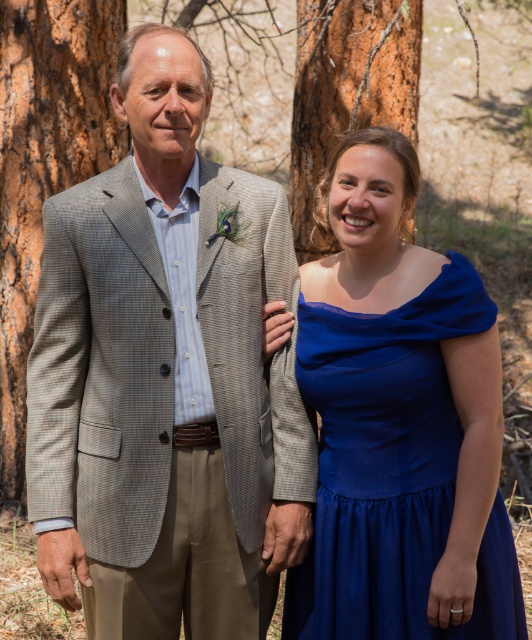
You are a photographer setting up a shot of the gray checkered suit at left and the brown textured bark at left. Which object should you focus on first if you want to capture both in sharp focus?

The gray checkered suit at left is positioned under the brown textured bark at left, so you should focus on the brown textured bark at left first to ensure both are in focus.

You are a photographer planning to take a portrait of the royal blue satin dress at right and the brown rough bark at upper center. To ensure both subjects are in focus, you need to know their vertical positions relative to each other. Which one is positioned lower in the frame?

The royal blue satin dress at right is positioned below the brown rough bark at upper center, so the dress is lower in the frame.

You are a photographer setting up a shoot in this forest scene. You have the royal blue satin dress at right and the brown rough bark at upper center in your frame. Based on their spatial relationship, which object would you adjust to ensure both are visible without overcrowding the composition?

Since the royal blue satin dress at right occupies less space than the brown rough bark at upper center, you could reduce the size or position of the brown rough bark at upper center to balance the composition and prevent overcrowding.